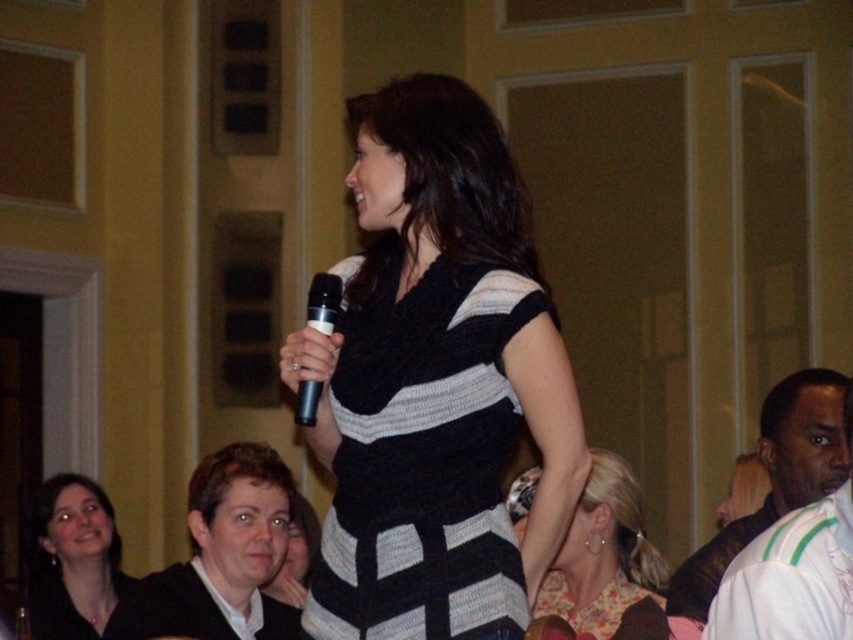
Does black knitted dress at center appear under dark brown hair at lower left?

Actually, black knitted dress at center is above dark brown hair at lower left.

This screenshot has width=853, height=640. What do you see at coordinates (424, 460) in the screenshot?
I see `black knitted dress at center` at bounding box center [424, 460].

Is point (323, 524) less distant than point (299, 609)?

Yes, it is in front of point (299, 609).

What are the coordinates of `black knitted dress at center` in the screenshot? It's located at (424, 460).

Can you confirm if white cotton shirt at right is shorter than black plastic microphone at center?

No.

Can you confirm if white cotton shirt at right is thinner than black plastic microphone at center?

In fact, white cotton shirt at right might be wider than black plastic microphone at center.

At what (x,y) coordinates should I click in order to perform the action: click on white cotton shirt at right. Please return your answer as a coordinate pair (x, y). Looking at the image, I should click on (775, 477).

Is dark brown hair at lower left wider than white cotton shirt at right?

No.

Between dark brown hair at lower left and white cotton shirt at right, which one is positioned lower?

dark brown hair at lower left

Is point (289, 628) closer to viewer compared to point (799, 371)?

That is False.

Locate an element on the screen. The height and width of the screenshot is (640, 853). dark brown hair at lower left is located at coordinates (221, 556).